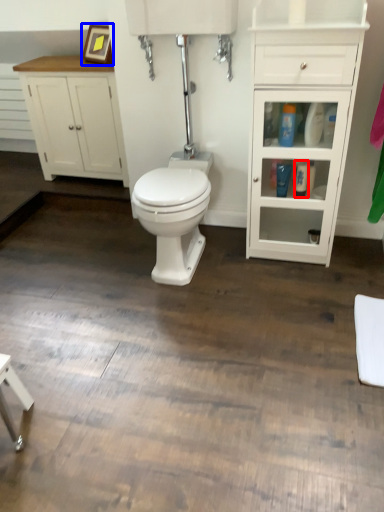
Question: Among these objects, which one is nearest to the camera, toiletry (highlighted by a red box) or picture frame (highlighted by a blue box)?

Choices:
 (A) toiletry
 (B) picture frame

Answer: (A)